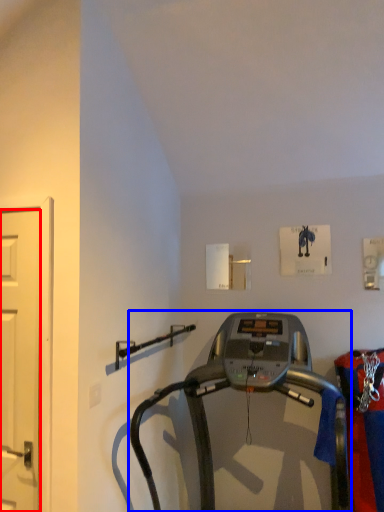
Question: Which object appears closest to the camera in this image, door (highlighted by a red box) or treadmill (highlighted by a blue box)?

Choices:
 (A) door
 (B) treadmill

Answer: (B)